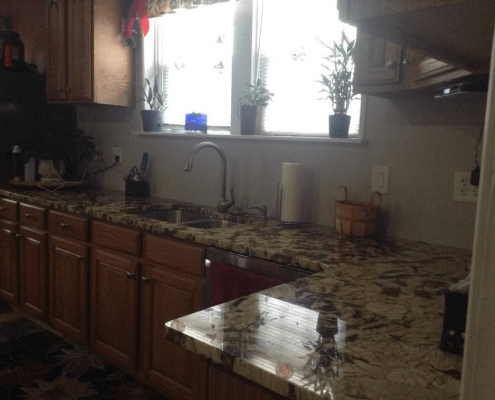
Locate an element on the screen. window is located at coordinates (186, 54), (301, 63).